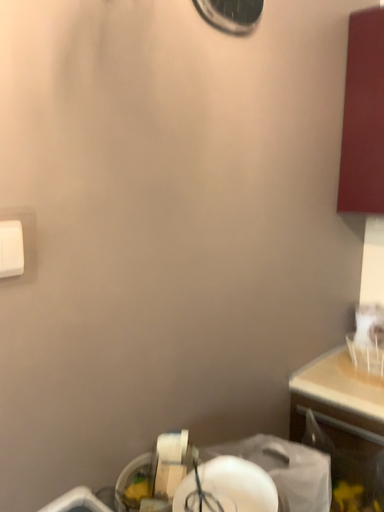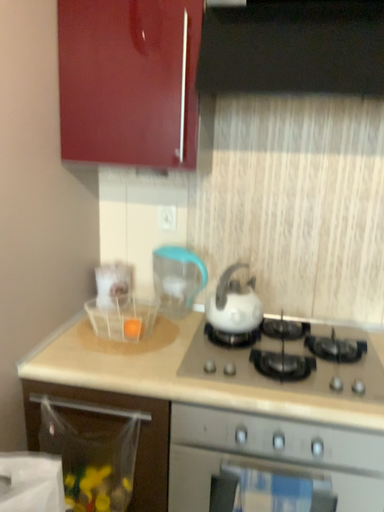
Question: Which way did the camera rotate in the video?

Choices:
 (A) rotated left
 (B) rotated right

Answer: (B)